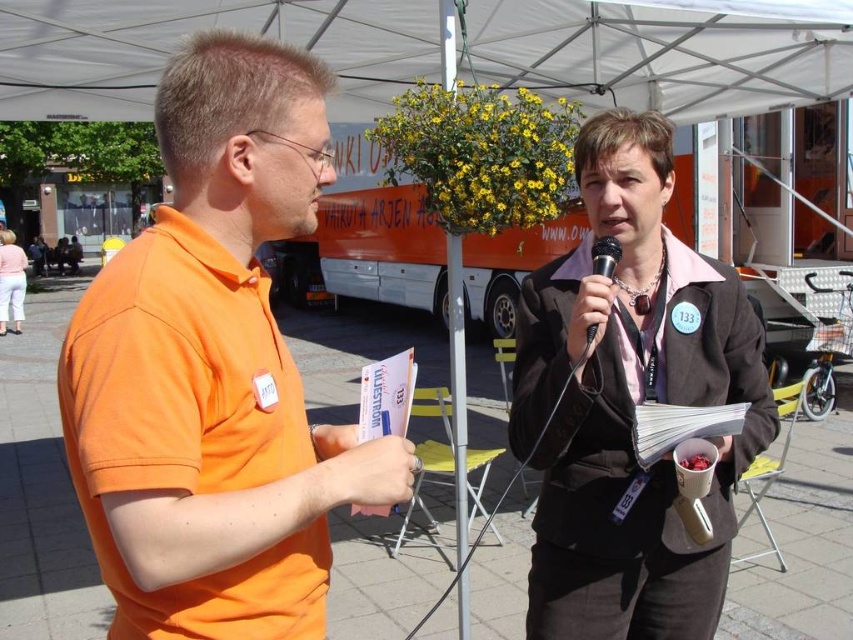
Identify the location of orange cotton shirt at left. The image size is (853, 640). (213, 371).

Consider the image. Which of these two, orange cotton shirt at left or white fabric canopy at upper center, stands taller?

orange cotton shirt at left is taller.

Where is `orange cotton shirt at left`? orange cotton shirt at left is located at coordinates (213, 371).

This screenshot has width=853, height=640. In order to click on orange cotton shirt at left in this screenshot , I will do `click(213, 371)`.

Does orange cotton shirt at left have a lesser height compared to black metallic microphone at center?

No.

Consider the image. Is orange cotton shirt at left taller than black metallic microphone at center?

Correct, orange cotton shirt at left is much taller as black metallic microphone at center.

Where is `orange cotton shirt at left`? Image resolution: width=853 pixels, height=640 pixels. orange cotton shirt at left is located at coordinates (213, 371).

This screenshot has width=853, height=640. I want to click on matte pink shirt at lower left, so click(x=10, y=282).

Does point (18, 304) come behind point (590, 340)?

Yes, it is.

The width and height of the screenshot is (853, 640). Identify the location of matte pink shirt at lower left. (10, 282).